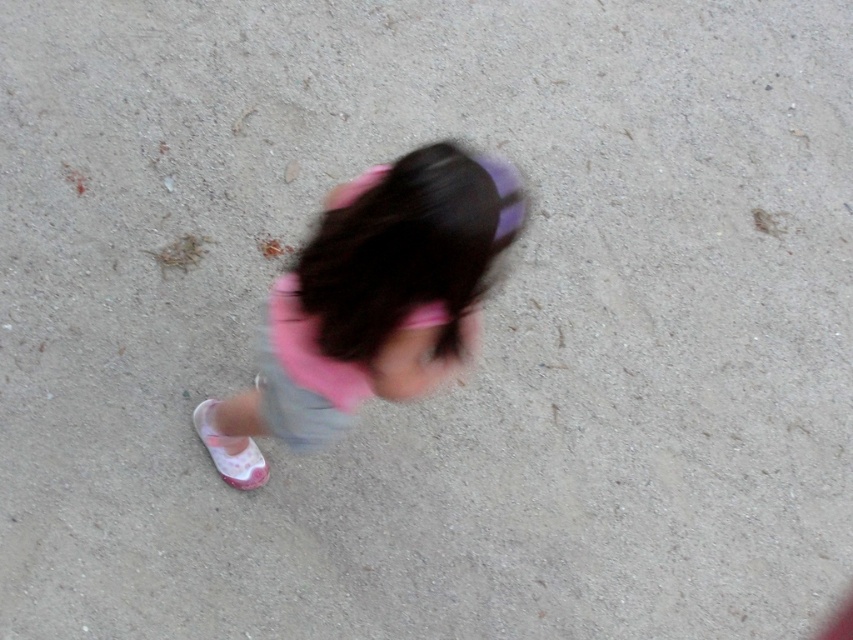
Question: Is pink fabric dress at center thinner than dark brown silky hair at center?

Choices:
 (A) yes
 (B) no

Answer: (B)

Question: Which point is farther to the camera?

Choices:
 (A) (194, 417)
 (B) (370, 385)

Answer: (A)

Question: Among these points, which one is nearest to the camera?

Choices:
 (A) (335, 244)
 (B) (410, 356)

Answer: (A)

Question: Which of the following is the closest to the observer?

Choices:
 (A) pink fabric dress at center
 (B) pink fabric hand at center
 (C) pink fabric shoe at lower left
 (D) dark brown silky hair at center

Answer: (D)

Question: Is pink fabric dress at center thinner than pink fabric hand at center?

Choices:
 (A) no
 (B) yes

Answer: (A)

Question: Considering the relative positions of dark brown silky hair at center and pink fabric hand at center in the image provided, where is dark brown silky hair at center located with respect to pink fabric hand at center?

Choices:
 (A) right
 (B) left

Answer: (A)